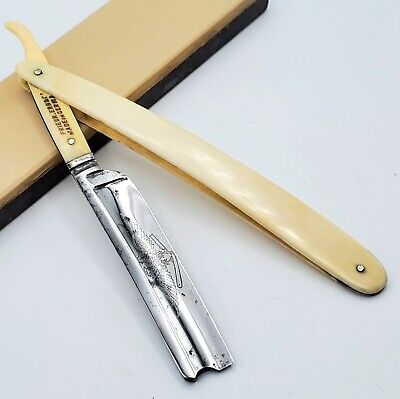
Locate an element on the screen. The height and width of the screenshot is (399, 400). swivel arm is located at coordinates (58, 142).